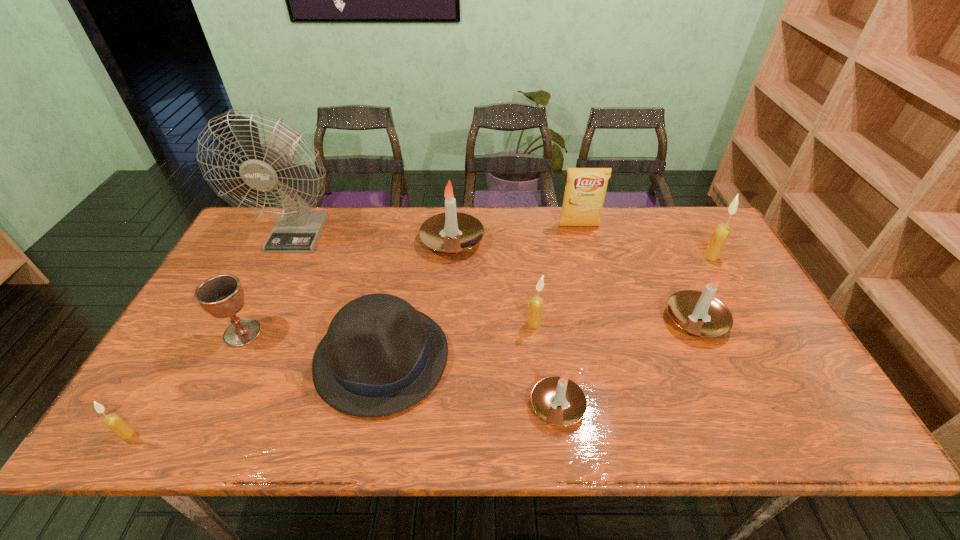
The width and height of the screenshot is (960, 540). In order to click on chalice that is positioned at the left edge in this screenshot , I will do `click(222, 296)`.

The width and height of the screenshot is (960, 540). I want to click on candle located in the left edge section of the desktop, so click(114, 422).

The width and height of the screenshot is (960, 540). I want to click on object situated at the far left corner, so click(297, 230).

I want to click on object present at the near left corner, so click(x=114, y=422).

Identify the location of object at the far right corner. The height and width of the screenshot is (540, 960). (720, 235).

Image resolution: width=960 pixels, height=540 pixels. In the image, there is a desktop. What are the coordinates of `free space at the far edge` in the screenshot? It's located at (513, 251).

Find the location of a particular element. This screenshot has width=960, height=540. vacant region at the near edge is located at coordinates (210, 405).

You are a GUI agent. You are given a task and a screenshot of the screen. Output one action in this format:
    pyautogui.click(x=<x>, y=<y>)
    Task: Click on the free region at the left edge
    This screenshot has height=540, width=960.
    Given the screenshot: What is the action you would take?
    pyautogui.click(x=250, y=259)

Where is `vacant region at the far left corner of the desktop`? This screenshot has width=960, height=540. vacant region at the far left corner of the desktop is located at coordinates (262, 243).

Locate an element on the screen. This screenshot has width=960, height=540. free area in between the smallest white candle and the second nearest cream candle is located at coordinates (546, 364).